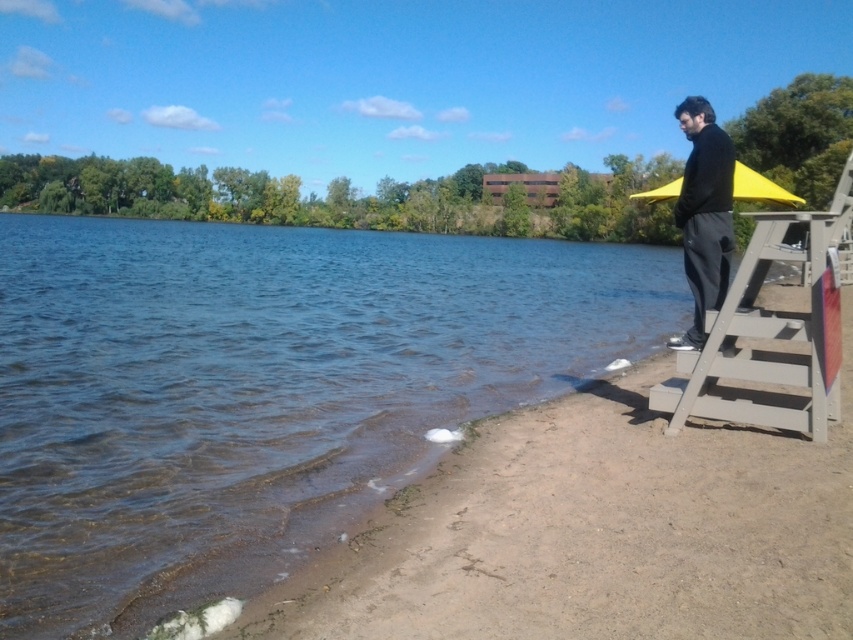
Question: Which object is farther from the camera taking this photo?

Choices:
 (A) light gray wooden ladder at right
 (B) black matte jacket at upper right
 (C) yellow matte umbrella at upper right

Answer: (C)

Question: Is clear blue water at lower left thinner than light gray wooden ladder at right?

Choices:
 (A) no
 (B) yes

Answer: (A)

Question: Does clear blue water at lower left appear under black matte jacket at upper right?

Choices:
 (A) yes
 (B) no

Answer: (A)

Question: Which object is farther from the camera taking this photo?

Choices:
 (A) clear blue water at lower left
 (B) light gray wooden ladder at right

Answer: (B)

Question: Is clear blue water at lower left positioned at the back of light gray wooden ladder at right?

Choices:
 (A) no
 (B) yes

Answer: (A)

Question: Which point appears closest to the camera in this image?

Choices:
 (A) (653, 198)
 (B) (221, 557)

Answer: (B)